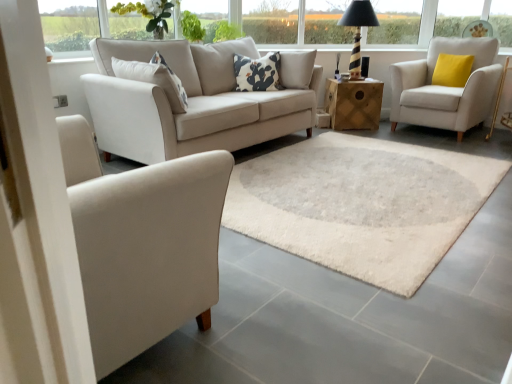
Question: Is transparent glass window at upper left, the second window positioned from the top, behind wooden cube at center?

Choices:
 (A) no
 (B) yes

Answer: (A)

Question: Are transparent glass window at upper left, the second window positioned from the top, and wooden cube at center located far from each other?

Choices:
 (A) yes
 (B) no

Answer: (A)

Question: Would you say transparent glass window at upper left, the 1th window in the front-to-back sequence, contains wooden cube at center?

Choices:
 (A) no
 (B) yes

Answer: (A)

Question: Does transparent glass window at upper left, the second window viewed from the back, have a greater width compared to wooden cube at center?

Choices:
 (A) no
 (B) yes

Answer: (A)

Question: Is transparent glass window at upper left, positioned as the 2th window in right-to-left order, bigger than wooden cube at center?

Choices:
 (A) yes
 (B) no

Answer: (B)

Question: Is transparent glass window at upper left, which is the 1th window from left to right, in contact with wooden cube at center?

Choices:
 (A) yes
 (B) no

Answer: (B)

Question: Can you confirm if wooden cube at center is positioned to the right of white shaggy rug at center?

Choices:
 (A) no
 (B) yes

Answer: (A)

Question: Is white shaggy rug at center located within wooden cube at center?

Choices:
 (A) no
 (B) yes

Answer: (A)

Question: Does wooden cube at center have a greater height compared to white shaggy rug at center?

Choices:
 (A) yes
 (B) no

Answer: (A)

Question: Is wooden cube at center thinner than white shaggy rug at center?

Choices:
 (A) yes
 (B) no

Answer: (B)

Question: From the image's perspective, would you say wooden cube at center is shown under white shaggy rug at center?

Choices:
 (A) yes
 (B) no

Answer: (B)

Question: Is wooden cube at center not inside white shaggy rug at center?

Choices:
 (A) no
 (B) yes

Answer: (B)

Question: Would you say matte white armchair at left, the 1th chair when ordered from bottom to top, is a long distance from white cotton pillow at center, the second pillow when ordered from back to front?

Choices:
 (A) no
 (B) yes

Answer: (B)